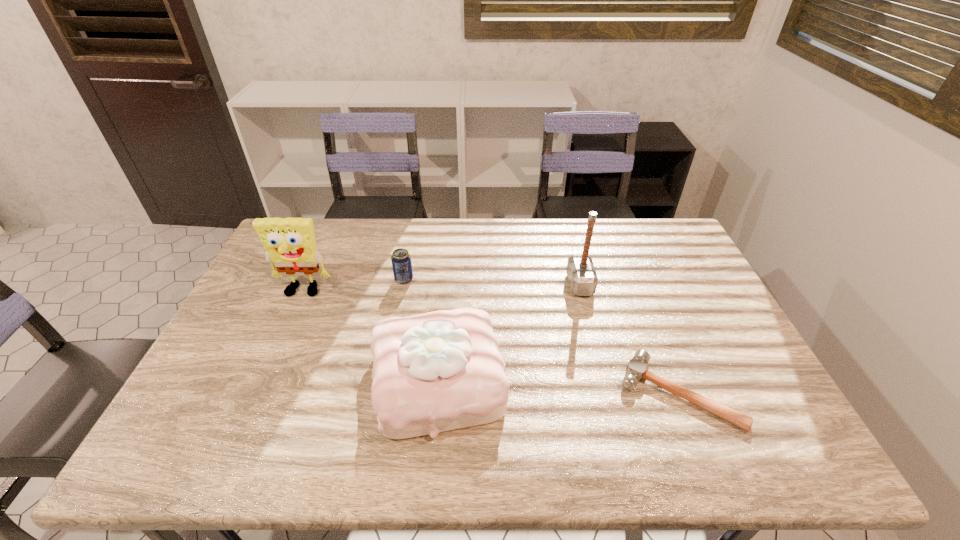
Where is `free space that is in between the third shortest object and the left hammer`? The width and height of the screenshot is (960, 540). free space that is in between the third shortest object and the left hammer is located at coordinates (509, 332).

The width and height of the screenshot is (960, 540). What are the coordinates of `the third closest object to the farther hammer` in the screenshot? It's located at (401, 260).

The height and width of the screenshot is (540, 960). Identify the location of the third closest object relative to the left hammer. (401, 260).

Identify the location of free space that satisfies the following two spatial constraints: 1. on the striking surface of the nearer hammer; 2. on the left side of the taller hammer. (608, 393).

Locate an element on the screen. The width and height of the screenshot is (960, 540). vacant space that satisfies the following two spatial constraints: 1. on the face of the shortest object; 2. on the right side of the leftmost object is located at coordinates (257, 393).

At what (x,y) coordinates should I click in order to perform the action: click on vacant position in the image that satisfies the following two spatial constraints: 1. on the striking surface of the rightmost object; 2. on the left side of the left hammer. Please return your answer as a coordinate pair (x, y). Looking at the image, I should click on (608, 393).